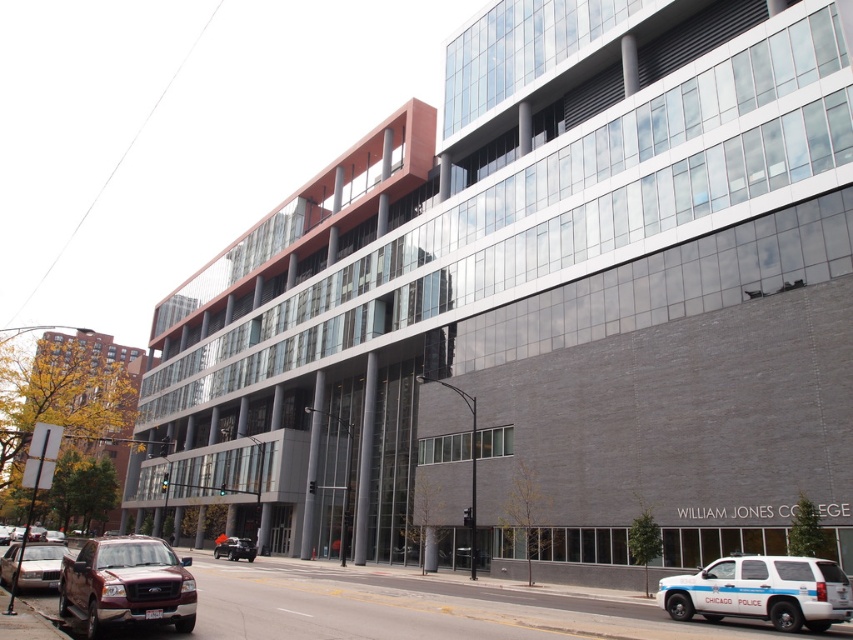
Does white matte suv at lower right have a lesser height compared to gold metallic sedan at lower left?

Yes.

Is white matte suv at lower right wider than gold metallic sedan at lower left?

Correct, the width of white matte suv at lower right exceeds that of gold metallic sedan at lower left.

Which is behind, point (770, 573) or point (7, 554)?

The point (7, 554) is behind.

Identify the location of white matte suv at lower right. (761, 592).

How far apart are white matte suv at lower right and metallic silver car at center?

white matte suv at lower right is 157.69 feet from metallic silver car at center.

Between white matte suv at lower right and metallic silver car at center, which one has more height?

Standing taller between the two is metallic silver car at center.

Does point (791, 605) lie in front of point (242, 541)?

That is True.

You are a GUI agent. You are given a task and a screenshot of the screen. Output one action in this format:
    pyautogui.click(x=<x>, y=<y>)
    Task: Click on the white matte suv at lower right
    
    Given the screenshot: What is the action you would take?
    pyautogui.click(x=761, y=592)

Which is behind, point (167, 560) or point (253, 541)?

Positioned behind is point (253, 541).

Who is positioned more to the left, matte red truck at lower left or metallic silver car at center?

metallic silver car at center is more to the left.

Between point (102, 548) and point (241, 541), which one is positioned behind?

Positioned behind is point (241, 541).

Where is `matte red truck at lower left`? Image resolution: width=853 pixels, height=640 pixels. matte red truck at lower left is located at coordinates (126, 584).